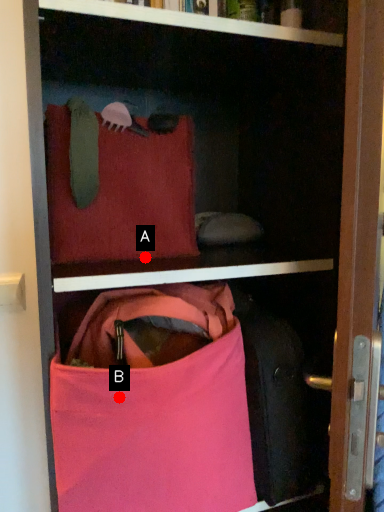
Question: Two points are circled on the image, labeled by A and B beside each circle. Which point appears closest to the camera in this image?

Choices:
 (A) A is closer
 (B) B is closer

Answer: (B)